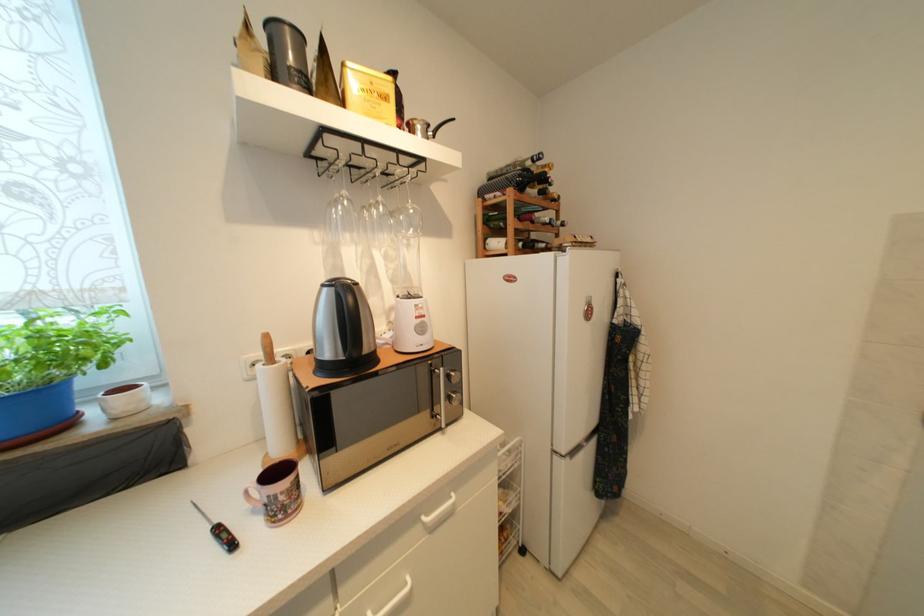
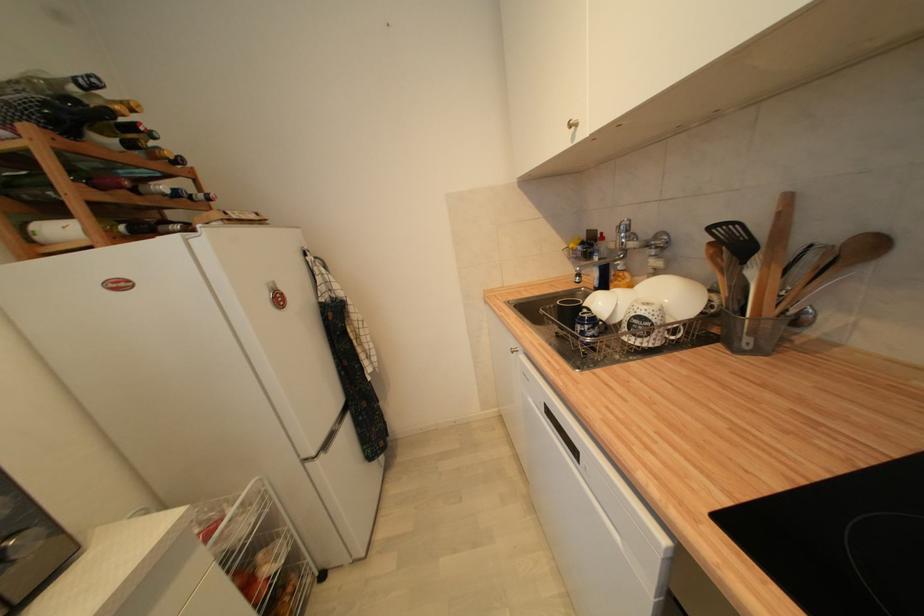
The point at (567, 225) is marked in the first image. Where is the corresponding point in the second image?

(213, 200)